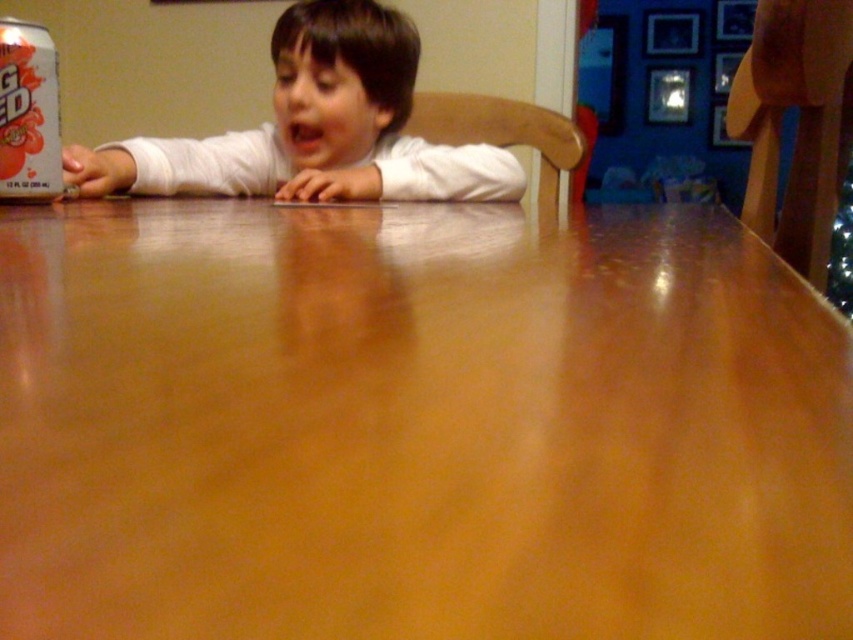
You are a photographer setting up for a family portrait. The scene has a white matte shirt at center and a matte silver can at upper left. To ensure the shirt is the focal point, you want to frame the shot so that the shirt takes up more horizontal space than the can. Based on the scene description, can you confirm if this arrangement is already achievable?

The white matte shirt at center might be wider than matte silver can at upper left, so it is possible that the shirt already takes up more horizontal space than the can. This arrangement could help make the shirt the focal point in the photograph.

You are standing at the point labeled point (x=91, y=188) and want to move to the point labeled point (x=618, y=413). Which direction should you move in to reach your destination?

You should move forward because point (x=618, y=413) is in front of point (x=91, y=188).

You are a photographer setting up a shoot with a young child wearing a white matte shirt at center and a matte silver can at upper left on a wooden table. You need to ensure the shirt doesn not block the can in the photo. Is the current arrangement acceptable?

The white matte shirt at center is positioned over the matte silver can at upper left, so the shirt is blocking the can. The current arrangement is not acceptable because the shirt is covering the can, making it less visible in the photo.